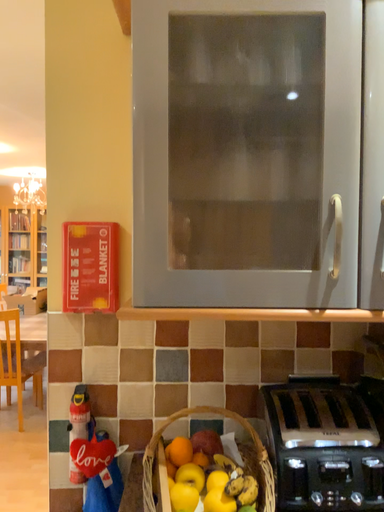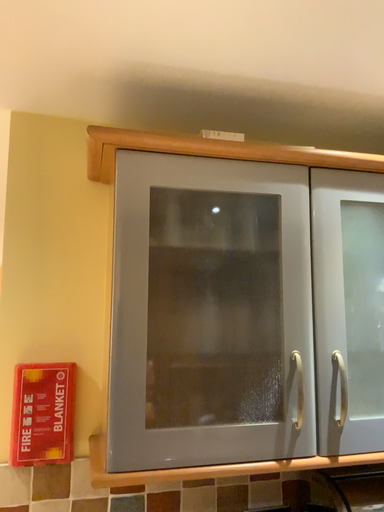
Question: How did the camera likely rotate when shooting the video?

Choices:
 (A) rotated left
 (B) rotated right

Answer: (B)